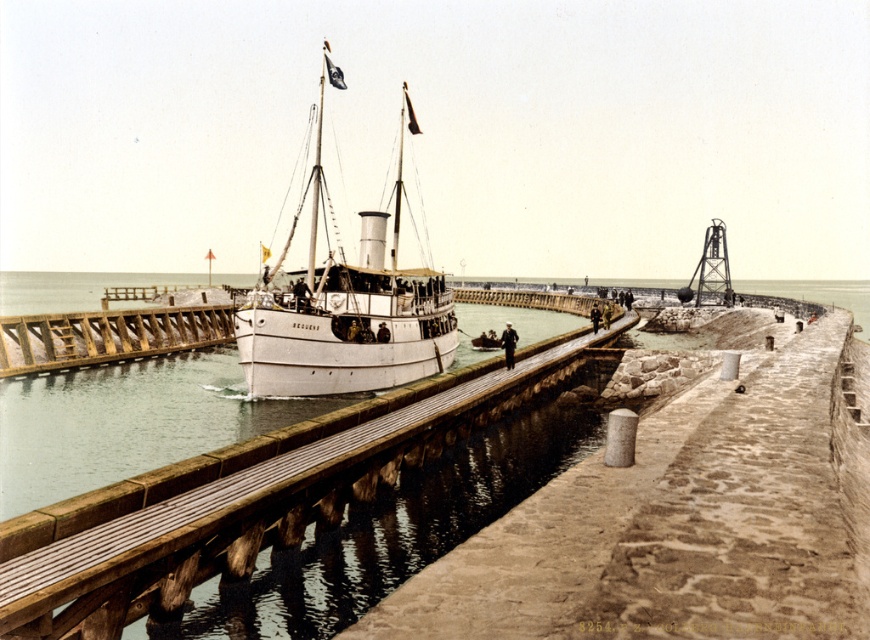
You are standing on the deck of the Secunda steamship and looking towards the harbor entrance. You notice two wooden structures in your view. One is labeled as wooden at center and the other as wooden at left. Based on their positions, which one is closer to the right side of the ship?

The wooden at center is closer to the right side of the ship because it is positioned to the right of wooden at left.

You are a dock worker observing the harbor and the ship. You need to secure the wooden at center to the white matte ship at center. Given their widths, which object would require more space to maneuver around?

The white matte ship at center requires more space to maneuver around since it has a greater width than the wooden at center.

You are a harbor inspector checking the harbor layout. You notice two structures at the center of the image. Which one takes up more space, the wooden at center or the white matte ship at center?

The white matte ship at center takes up more space than the wooden at center because the wooden at center occupies less space than the white matte ship at center.